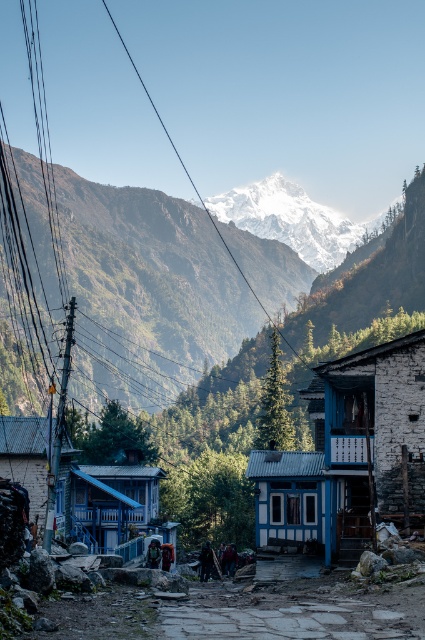
You are a traveler who wants to stay in a place with more space. Which building would you choose between the white stone building at center and the blue painted wood hut at center?

The blue painted wood hut at center occupies more space than the white stone building at center, so you should choose the blue painted wood hut at center for more space.